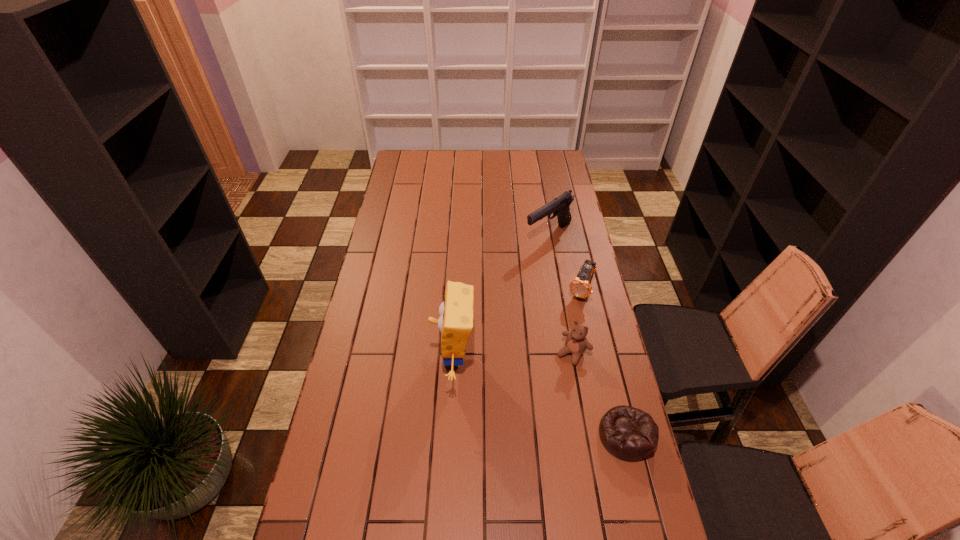
The width and height of the screenshot is (960, 540). What are the coordinates of `the leftmost object` in the screenshot? It's located at (455, 323).

Where is `the tallest object`? The width and height of the screenshot is (960, 540). the tallest object is located at coordinates (455, 323).

This screenshot has width=960, height=540. I want to click on the nearest object, so click(630, 434).

I want to click on the shortest object, so click(630, 434).

Identify the location of the second tallest object. The height and width of the screenshot is (540, 960). (559, 207).

You are a GUI agent. You are given a task and a screenshot of the screen. Output one action in this format:
    pyautogui.click(x=<x>, y=<y>)
    Task: Click on the farthest object
    This screenshot has width=960, height=540.
    Given the screenshot: What is the action you would take?
    pyautogui.click(x=559, y=207)

What are the coordinates of `the fourth nearest object` in the screenshot? It's located at (580, 286).

Locate an element on the screen. The height and width of the screenshot is (540, 960). teddy bear is located at coordinates pyautogui.click(x=576, y=343).

At what (x,y) coordinates should I click in order to perform the action: click on vacant space located on the face of the sponge. Please return your answer as a coordinate pair (x, y). The image size is (960, 540). Looking at the image, I should click on (347, 359).

Where is `vacant area located on the face of the sponge`? This screenshot has width=960, height=540. vacant area located on the face of the sponge is located at coordinates (368, 359).